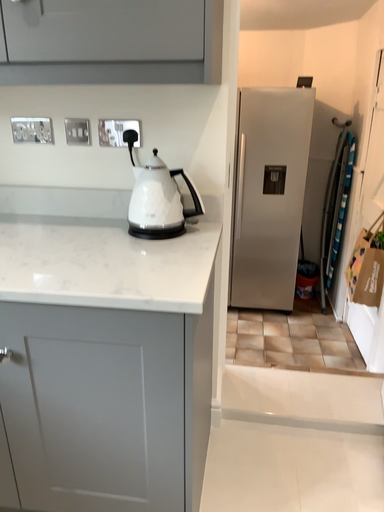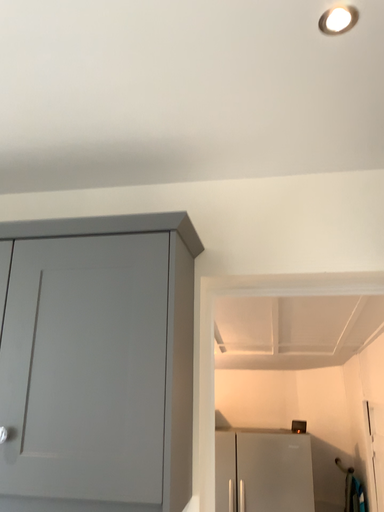
Question: How did the camera likely rotate when shooting the video?

Choices:
 (A) rotated upward
 (B) rotated downward

Answer: (A)